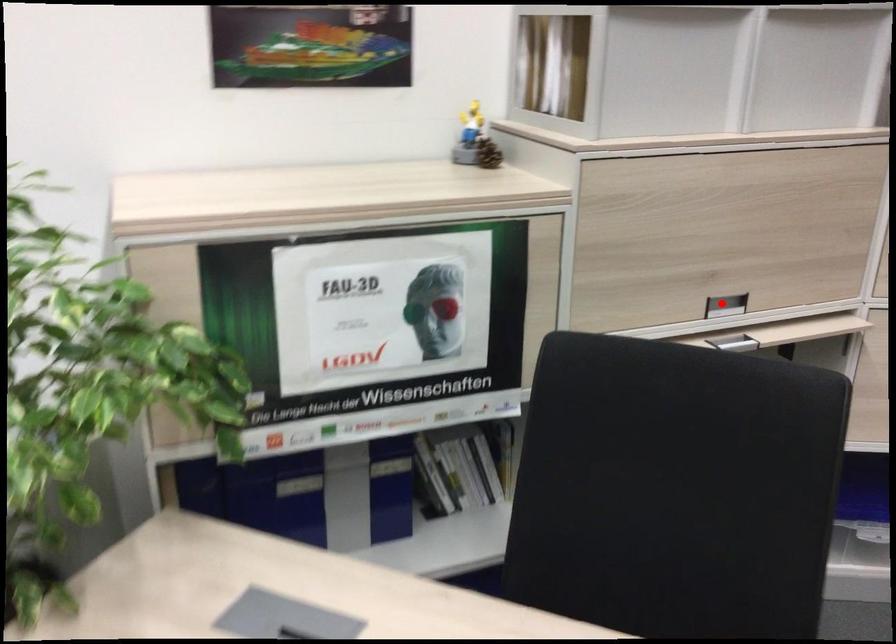
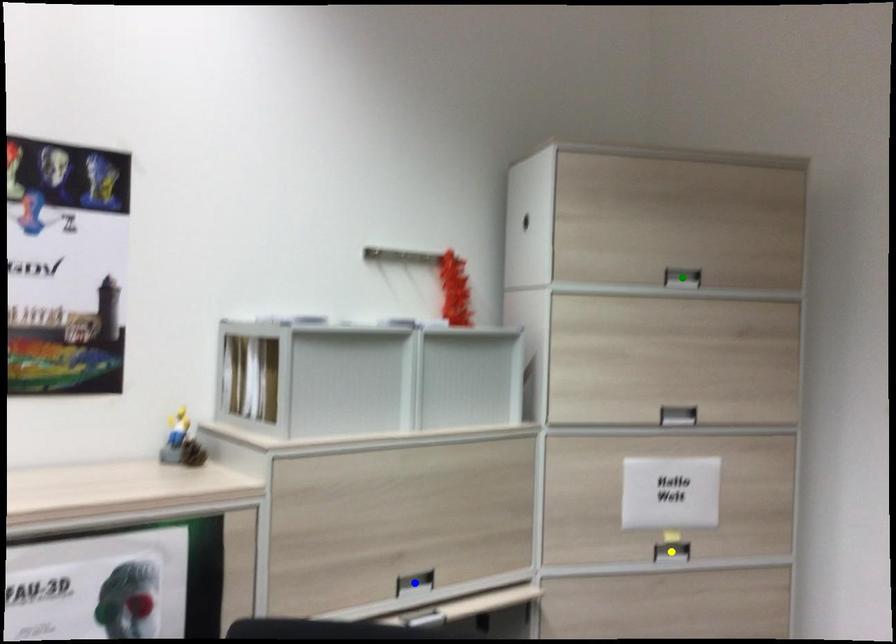
Question: I am providing you with two images of the same scene from different viewpoints. A red point is marked on the first image. You are given multiple points on the second image. Which spot in image 2 lines up with the point in image 1?

Choices:
 (A) yellow point
 (B) blue point
 (C) green point

Answer: (B)